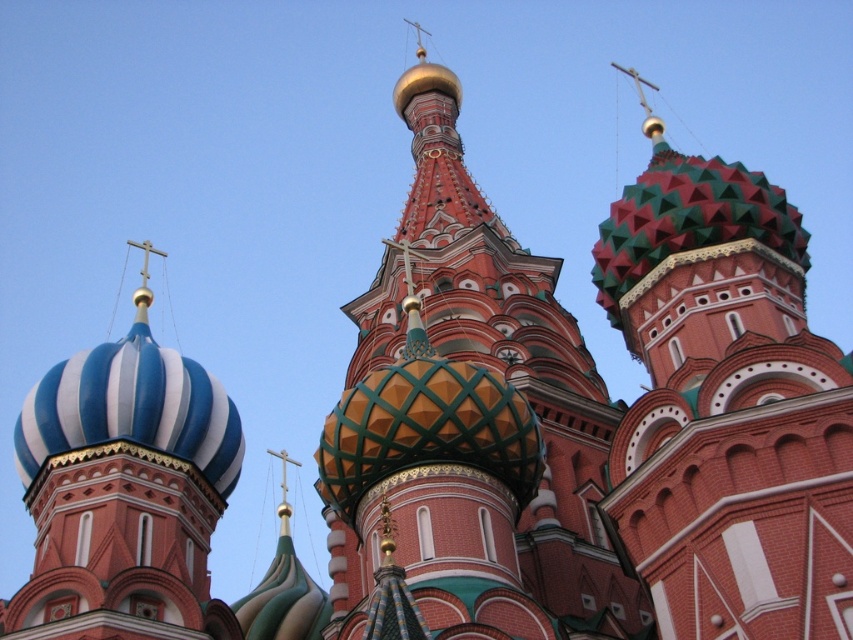
In the scene shown: You are standing in front of the grand cathedral. You notice the green and red mosaic dome at center and the blue and white striped dome at left. Which dome is closer to you?

The green and red mosaic dome at center is closer to you because it is in front of the blue and white striped dome at left.

You are an architect examining the cathedral. You notice the multicolored mosaic dome at center and the green and red mosaic dome at center. Which dome is located above the other?

The green and red mosaic dome at center is positioned above the multicolored mosaic dome at center.